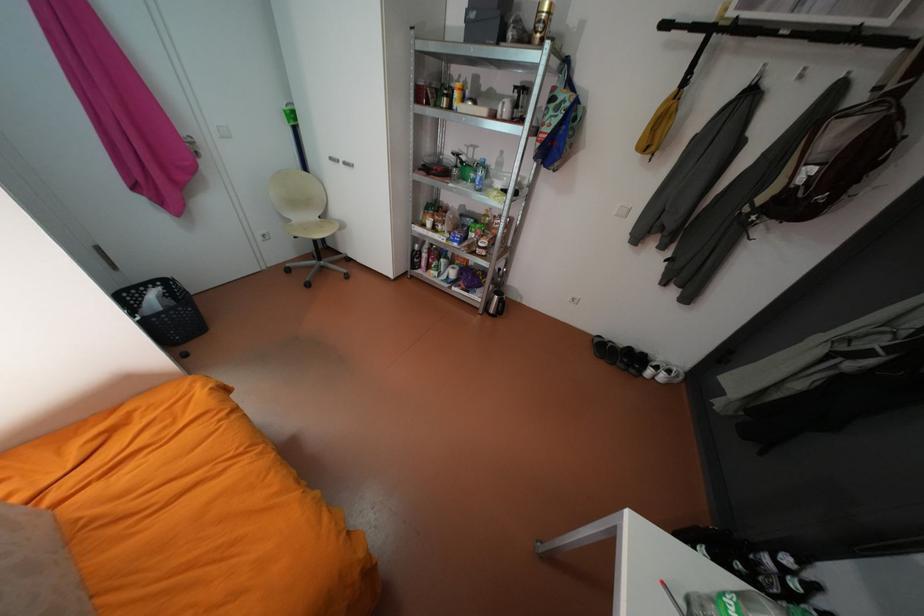
Where is `pink pump bottle`? pink pump bottle is located at coordinates (423, 256).